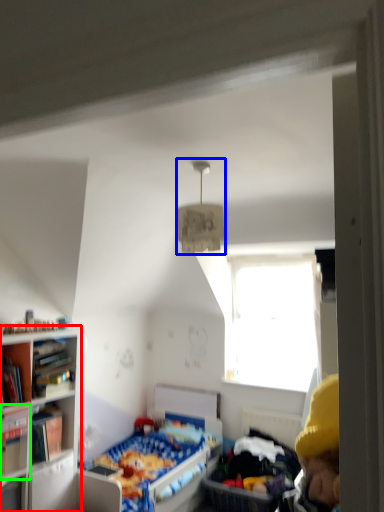
Question: Considering the real-world distances, which object is closest to bookcase (highlighted by a red box)? light fixture (highlighted by a blue box) or book (highlighted by a green box).

Choices:
 (A) light fixture
 (B) book

Answer: (B)